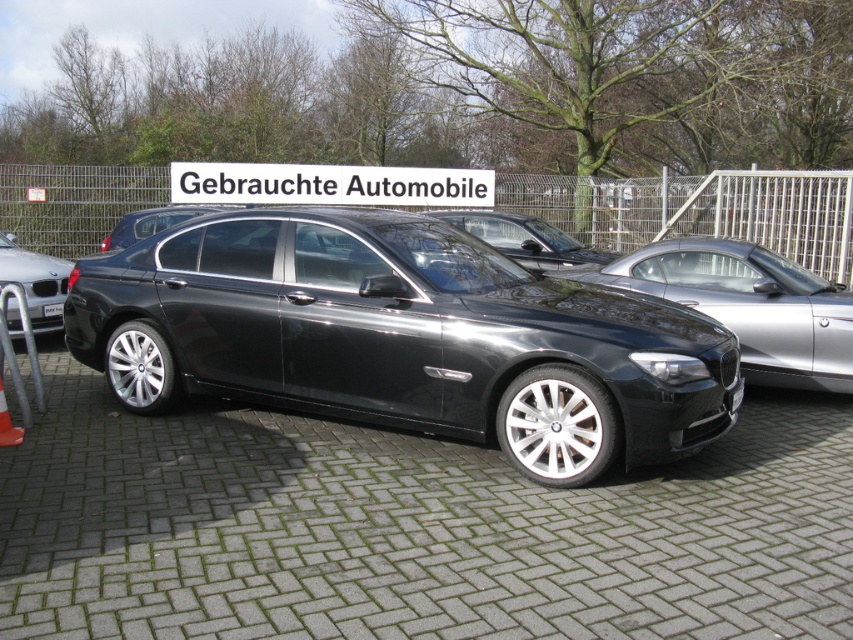
Question: Can you confirm if glossy metallic sedan at center is bigger than white plastic sign at center?

Choices:
 (A) yes
 (B) no

Answer: (A)

Question: Is glossy metallic sedan at center smaller than black plastic license plate at center?

Choices:
 (A) yes
 (B) no

Answer: (B)

Question: Considering the real-world distances, which object is closest to the glossy black car at center?

Choices:
 (A) white plastic sign at center
 (B) glossy metallic car at center
 (C) glossy metallic sedan at center

Answer: (C)

Question: Observing the image, what is the correct spatial positioning of glossy metallic sedan at center in reference to shiny metallic car at left?

Choices:
 (A) above
 (B) below

Answer: (B)

Question: Which point is farther to the camera?

Choices:
 (A) (527, 236)
 (B) (61, 312)

Answer: (A)

Question: Which of the following is the farthest from the observer?

Choices:
 (A) glossy black car at center
 (B) white plastic sign at center
 (C) glossy metallic sedan at center
 (D) shiny metallic car at left

Answer: (B)